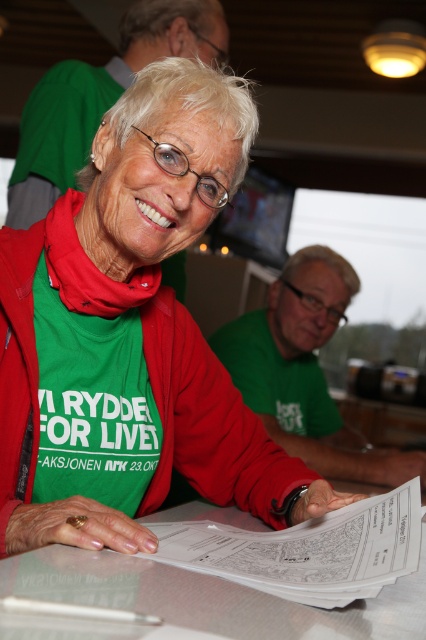
Is point (172, 584) behind point (267, 376)?

That is False.

Who is positioned more to the left, white glossy table at center or green matte shirt at center?

→ white glossy table at center

Does point (17, 612) come farther from viewer compared to point (258, 381)?

No, (17, 612) is closer to viewer.

Where is `white glossy table at center`? white glossy table at center is located at coordinates (190, 602).

Who is positioned more to the right, green fabric shirt at center or green matte shirt at center?

From the viewer's perspective, green matte shirt at center appears more on the right side.

Which of these two, green fabric shirt at center or green matte shirt at center, stands shorter?

Standing shorter between the two is green matte shirt at center.

Where is `green fabric shirt at center`? green fabric shirt at center is located at coordinates (132, 333).

Can you confirm if green fabric shirt at center is wider than white glossy table at center?

Indeed, green fabric shirt at center has a greater width compared to white glossy table at center.

Is point (83, 205) more distant than point (394, 604)?

Yes, point (83, 205) is behind point (394, 604).

At what (x,y) coordinates should I click in order to perform the action: click on green fabric shirt at center. Please return your answer as a coordinate pair (x, y). Looking at the image, I should click on [x=132, y=333].